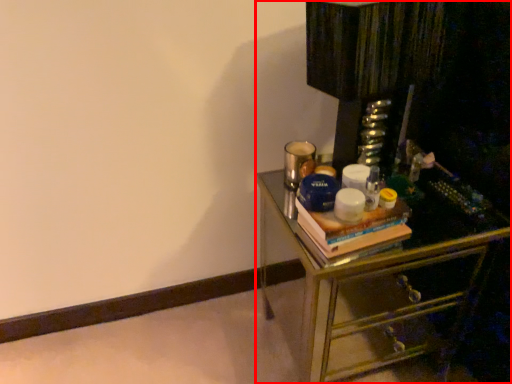
Question: From the image's perspective, where is chest of drawers (annotated by the red box) located relative to book?

Choices:
 (A) above
 (B) below

Answer: (B)